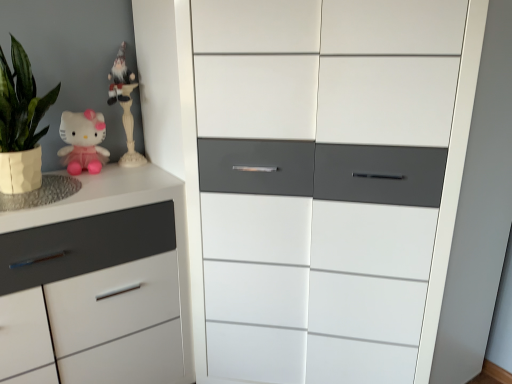
What is the approximate height of white glossy gnome at upper left?

It is 18.56 inches.

Where is `white glossy gnome at upper left`? This screenshot has height=384, width=512. white glossy gnome at upper left is located at coordinates pos(124,105).

Is matte pink plush at upper left far from white glossy cabinet at center, the 1th chest of drawers viewed from the right?

Actually, matte pink plush at upper left and white glossy cabinet at center, the 1th chest of drawers viewed from the right, are a little close together.

Which is further, (100, 161) or (225, 166)?

Positioned behind is point (100, 161).

Between matte pink plush at upper left and white glossy cabinet at center, the 1th chest of drawers viewed from the right, which one has larger width?

white glossy cabinet at center, the 1th chest of drawers viewed from the right.

Which chest of drawers is the 2nd one when counting from the front of the matte pink plush at upper left? Please provide its 2D coordinates.

[(311, 176)]

What's the angular difference between matte pink plush at upper left and white glossy gnome at upper left's facing directions?

The facing directions of matte pink plush at upper left and white glossy gnome at upper left are 5.78 degrees apart.

From a real-world perspective, which is physically below, matte pink plush at upper left or white glossy gnome at upper left?

From a 3D spatial view, matte pink plush at upper left is below.

Considering the relative positions of matte pink plush at upper left and white glossy gnome at upper left in the image provided, is matte pink plush at upper left behind white glossy gnome at upper left?

No, matte pink plush at upper left is closer to the viewer.

Would you say white glossy gnome at upper left is outside white glossy cabinet at center, the 1th chest of drawers viewed from the right?

Absolutely, white glossy gnome at upper left is external to white glossy cabinet at center, the 1th chest of drawers viewed from the right.

Can you confirm if white glossy gnome at upper left is positioned to the left of white glossy cabinet at center, positioned as the second chest of drawers in left-to-right order?

Indeed, white glossy gnome at upper left is positioned on the left side of white glossy cabinet at center, positioned as the second chest of drawers in left-to-right order.

Could you tell me if white glossy gnome at upper left is facing white glossy cabinet at center, the 1th chest of drawers viewed from the right?

No, white glossy gnome at upper left is not aimed at white glossy cabinet at center, the 1th chest of drawers viewed from the right.

Locate an element on the screen. The height and width of the screenshot is (384, 512). miniature positioned vertically above the white glossy cabinet at center, the 1th chest of drawers viewed from the right (from a real-world perspective) is located at coordinates (124, 105).

Consider the image. From the image's perspective, which one is positioned higher, white glossy gnome at upper left or white matte chest of drawers at left, which ranks as the first chest of drawers in left-to-right order?

white glossy gnome at upper left, from the image's perspective.

Would you say white glossy gnome at upper left is a long distance from white matte chest of drawers at left, which ranks as the first chest of drawers in left-to-right order?

No.

Is white glossy gnome at upper left closer to the viewer compared to white matte chest of drawers at left, which ranks as the first chest of drawers in left-to-right order?

No, the depth of white glossy gnome at upper left is greater than that of white matte chest of drawers at left, which ranks as the first chest of drawers in left-to-right order.

Is white glossy gnome at upper left aimed at white matte chest of drawers at left, which ranks as the first chest of drawers in left-to-right order?

No, white glossy gnome at upper left does not turn towards white matte chest of drawers at left, which ranks as the first chest of drawers in left-to-right order.

Which is more to the right, white matte chest of drawers at left, which ranks as the first chest of drawers in left-to-right order, or matte pink plush at upper left?

Positioned to the right is matte pink plush at upper left.

From the image's perspective, would you say white matte chest of drawers at left, which ranks as the first chest of drawers in left-to-right order, is positioned over matte pink plush at upper left?

No, from the image's perspective, white matte chest of drawers at left, which ranks as the first chest of drawers in left-to-right order, is not above matte pink plush at upper left.

Does white matte chest of drawers at left, which ranks as the first chest of drawers in left-to-right order, come behind matte pink plush at upper left?

No, white matte chest of drawers at left, which ranks as the first chest of drawers in left-to-right order, is closer to the camera.

How much distance is there between white glossy cabinet at center, positioned as the second chest of drawers in left-to-right order, and matte pink plush at upper left?

white glossy cabinet at center, positioned as the second chest of drawers in left-to-right order, is 30.14 inches from matte pink plush at upper left.

From the image's perspective, which is below, white glossy cabinet at center, the 1th chest of drawers viewed from the right, or matte pink plush at upper left?

white glossy cabinet at center, the 1th chest of drawers viewed from the right, is shown below in the image.

Which object is closer to the camera taking this photo, white glossy cabinet at center, positioned as the second chest of drawers in left-to-right order, or matte pink plush at upper left?

Positioned in front is white glossy cabinet at center, positioned as the second chest of drawers in left-to-right order.

Is white glossy cabinet at center, the 1th chest of drawers viewed from the right, inside or outside of matte pink plush at upper left?

white glossy cabinet at center, the 1th chest of drawers viewed from the right, exists outside the volume of matte pink plush at upper left.

From a real-world perspective, is white glossy cabinet at center, the 1th chest of drawers viewed from the right, on top of white matte chest of drawers at left, which ranks as the first chest of drawers in left-to-right order?

Yes.

Does point (230, 342) come closer to viewer compared to point (117, 350)?

No, (230, 342) is behind (117, 350).

Which of these two, white glossy cabinet at center, positioned as the second chest of drawers in left-to-right order, or white matte chest of drawers at left, the second chest of drawers positioned from the right, is wider?

white glossy cabinet at center, positioned as the second chest of drawers in left-to-right order, is wider.

Between white glossy cabinet at center, positioned as the second chest of drawers in left-to-right order, and white matte chest of drawers at left, which ranks as the first chest of drawers in left-to-right order, which one appears on the left side from the viewer's perspective?

Positioned to the left is white matte chest of drawers at left, which ranks as the first chest of drawers in left-to-right order.

Locate an element on the screen. Image resolution: width=512 pixels, height=384 pixels. doll behind the white glossy cabinet at center, positioned as the second chest of drawers in left-to-right order is located at coordinates (83, 141).

Locate an element on the screen. The image size is (512, 384). doll to the left of white glossy gnome at upper left is located at coordinates (83, 141).

Based on the photo, estimate the real-world distances between objects in this image. Which object is further from white glossy gnome at upper left, white glossy cabinet at center, the 1th chest of drawers viewed from the right, or matte pink plush at upper left?

The object further to white glossy gnome at upper left is white glossy cabinet at center, the 1th chest of drawers viewed from the right.

Which object lies nearer to the anchor point white glossy cabinet at center, the 1th chest of drawers viewed from the right, matte pink plush at upper left or white matte chest of drawers at left, which ranks as the first chest of drawers in left-to-right order?

Among the two, white matte chest of drawers at left, which ranks as the first chest of drawers in left-to-right order, is located nearer to white glossy cabinet at center, the 1th chest of drawers viewed from the right.

Based on their spatial positions, is white matte chest of drawers at left, the second chest of drawers positioned from the right, or matte pink plush at upper left closer to white glossy gnome at upper left?

matte pink plush at upper left.

Which object lies further to the anchor point matte pink plush at upper left, white glossy cabinet at center, positioned as the second chest of drawers in left-to-right order, or white glossy gnome at upper left?

white glossy cabinet at center, positioned as the second chest of drawers in left-to-right order, is positioned further to the anchor matte pink plush at upper left.

When comparing their distances from white glossy gnome at upper left, does matte pink plush at upper left or white glossy cabinet at center, positioned as the second chest of drawers in left-to-right order, seem further?

white glossy cabinet at center, positioned as the second chest of drawers in left-to-right order, is positioned further to the anchor white glossy gnome at upper left.

From the image, which object appears to be nearer to white matte chest of drawers at left, the second chest of drawers positioned from the right, white glossy gnome at upper left or white glossy cabinet at center, positioned as the second chest of drawers in left-to-right order?

white glossy cabinet at center, positioned as the second chest of drawers in left-to-right order.

Based on their spatial positions, is matte pink plush at upper left or white glossy gnome at upper left closer to white matte chest of drawers at left, which ranks as the first chest of drawers in left-to-right order?

The object closer to white matte chest of drawers at left, which ranks as the first chest of drawers in left-to-right order, is matte pink plush at upper left.

Considering their positions, is white glossy cabinet at center, the 1th chest of drawers viewed from the right, positioned closer to white glossy gnome at upper left than white matte chest of drawers at left, which ranks as the first chest of drawers in left-to-right order?

Based on the image, white matte chest of drawers at left, which ranks as the first chest of drawers in left-to-right order, appears to be nearer to white glossy gnome at upper left.

The width and height of the screenshot is (512, 384). In order to click on miniature situated between matte pink plush at upper left and white glossy cabinet at center, positioned as the second chest of drawers in left-to-right order, from left to right in this screenshot , I will do 124,105.

Identify the location of doll that lies between white glossy gnome at upper left and white matte chest of drawers at left, which ranks as the first chest of drawers in left-to-right order, from top to bottom. (83, 141).

The image size is (512, 384). I want to click on miniature between white matte chest of drawers at left, the second chest of drawers positioned from the right, and white glossy cabinet at center, the 1th chest of drawers viewed from the right, from left to right, so click(x=124, y=105).

Identify the location of doll situated between white matte chest of drawers at left, the second chest of drawers positioned from the right, and white glossy cabinet at center, the 1th chest of drawers viewed from the right, from left to right. (83, 141).